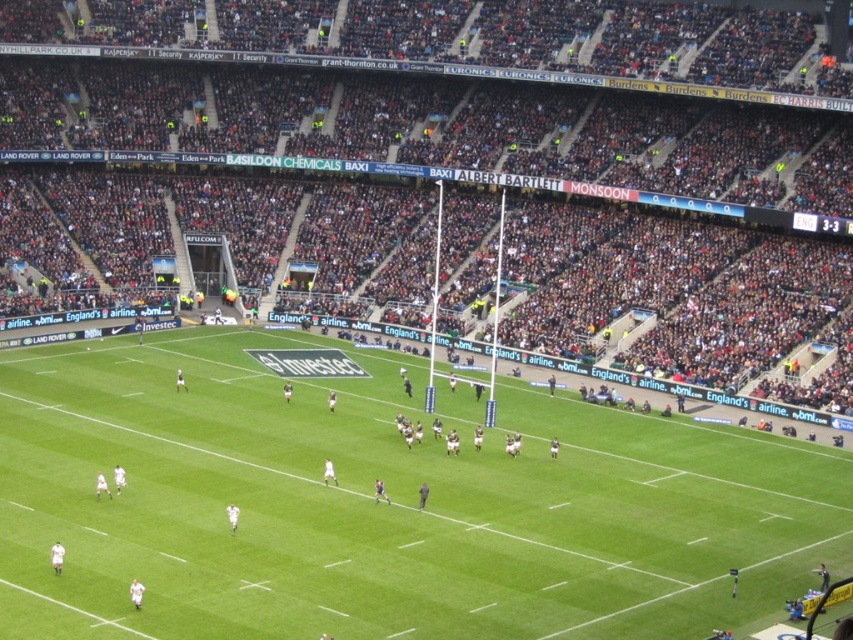
You are a drone operator trying to capture a photo of the green grass football field at center. However, you notice that the dark gray stadium seats at center might block your view. Based on the scene, will the seats obstruct the football field in your photo?

The dark gray stadium seats at center are further to the viewer than the green grass football field at center, so they will block the view of the football field in the photo.

You are a player on the rugby field and need to pass the ball to your teammate. You are currently at point [354,208] and your teammate is at point [824,532]. Is your teammate in front of you or behind you?

Point [354,208] is behind point [824,532], so your teammate at point [824,532] is in front of you.